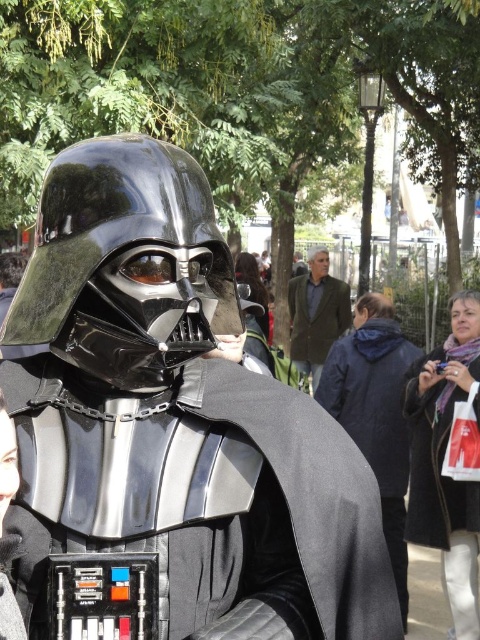
The height and width of the screenshot is (640, 480). Identify the location of glossy black helmet at center. (127, 264).

Is the position of glossy black helmet at center less distant than that of black matte cape at center?

Yes, glossy black helmet at center is in front of black matte cape at center.

Is point (148, 172) positioned behind point (397, 378)?

That is False.

You are a GUI agent. You are given a task and a screenshot of the screen. Output one action in this format:
    pyautogui.click(x=<x>, y=<y>)
    Task: Click on the glossy black helmet at center
    
    Given the screenshot: What is the action you would take?
    pyautogui.click(x=127, y=264)

Does glossy black helmet at center have a smaller size compared to green textured jacket at center?

Indeed, glossy black helmet at center has a smaller size compared to green textured jacket at center.

Between point (100, 228) and point (291, 324), which one is positioned in front?

Point (100, 228)

Between point (160, 157) and point (321, 291), which one is positioned in front?

Positioned in front is point (160, 157).

Where is `glossy black helmet at center`? glossy black helmet at center is located at coordinates (127, 264).

Is point (467, 580) farther from viewer compared to point (396, 422)?

That is False.

Which is in front, point (431, 371) or point (391, 419)?

Positioned in front is point (431, 371).

Locate an element on the screen. Image resolution: width=480 pixels, height=640 pixels. black matte scarf at lower right is located at coordinates (444, 476).